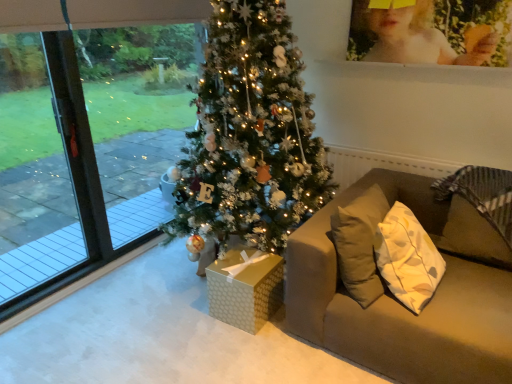
The height and width of the screenshot is (384, 512). Find the location of `free space in front of gold textured gift box at center`. free space in front of gold textured gift box at center is located at coordinates (247, 346).